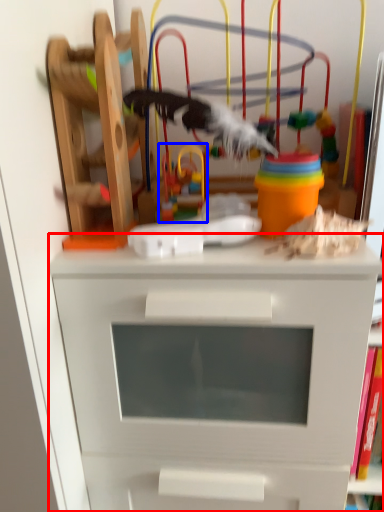
Question: Which of the following is the closest to the observer, chest of drawers (highlighted by a red box) or toy (highlighted by a blue box)?

Choices:
 (A) chest of drawers
 (B) toy

Answer: (A)